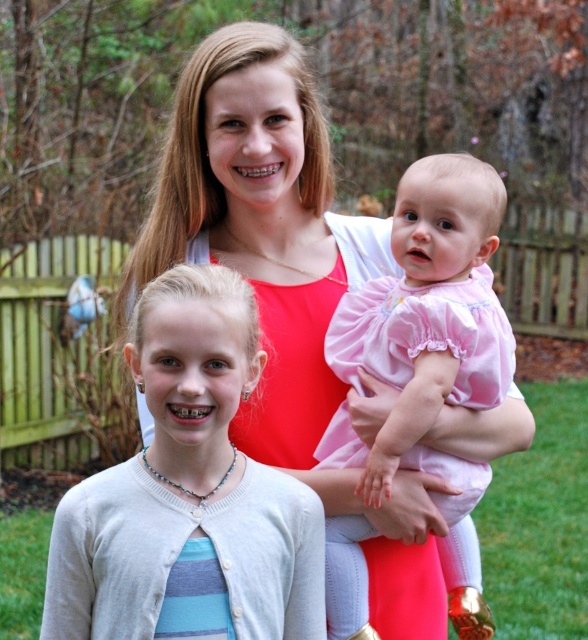
At what (x,y) coordinates should I click in order to perform the action: click on matte red tank top at center. Please return your answer as a coordinate pair (x, y). The image size is (588, 640). Looking at the image, I should click on (294, 298).

Can you confirm if matte red tank top at center is bigger than white knit cardigan at center?

Indeed, matte red tank top at center has a larger size compared to white knit cardigan at center.

Describe the element at coordinates (294, 298) in the screenshot. Image resolution: width=588 pixels, height=640 pixels. I see `matte red tank top at center` at that location.

I want to click on matte red tank top at center, so click(x=294, y=298).

Is matte red tank top at center positioned in front of pink satin dress at center?

No, matte red tank top at center is behind pink satin dress at center.

Is matte red tank top at center behind pink satin dress at center?

That is True.

Which is in front, point (369, 612) or point (442, 193)?

Positioned in front is point (442, 193).

Locate an element on the screen. Image resolution: width=588 pixels, height=640 pixels. matte red tank top at center is located at coordinates (294, 298).

How much distance is there between white knit cardigan at center and pink satin dress at center?

18.39 inches

Is point (315, 538) farther from viewer compared to point (365, 301)?

No.

Based on the photo, who is more forward, [295,500] or [450,177]?

Point [295,500] is more forward.

Locate an element on the screen. white knit cardigan at center is located at coordinates (188, 493).